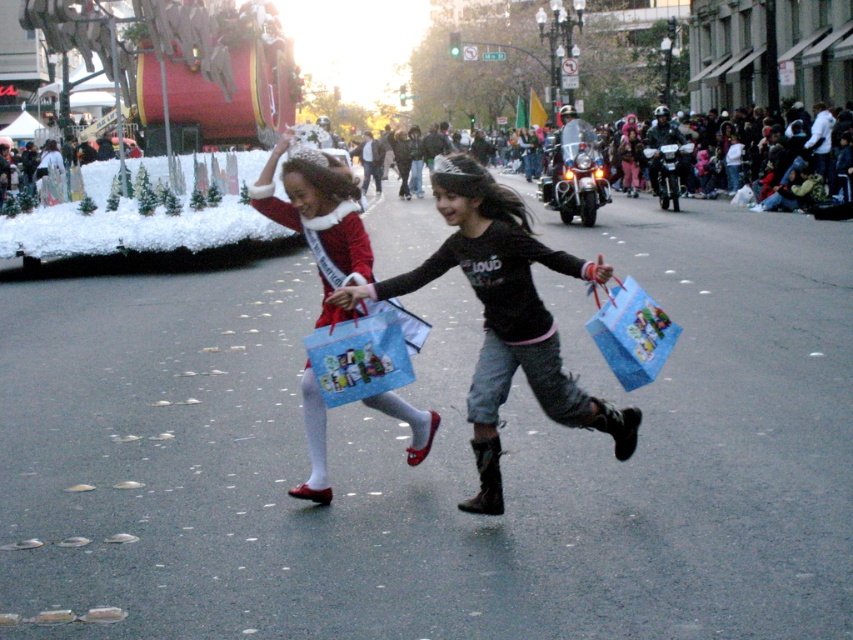
You are designing a new pair of shoes and want to ensure they fit within a standard shoebox. You observe the matte black boots at center and the matte red dress at center in the image. Which object has a greater width that might require a larger shoebox?

The matte black boots at center has a greater width than the matte red dress at center, so it would require a larger shoebox.

You are a photographer trying to capture the matte black boots at center in the image. What are the coordinates where you should focus your camera?

The coordinates to focus on are point (503, 316).